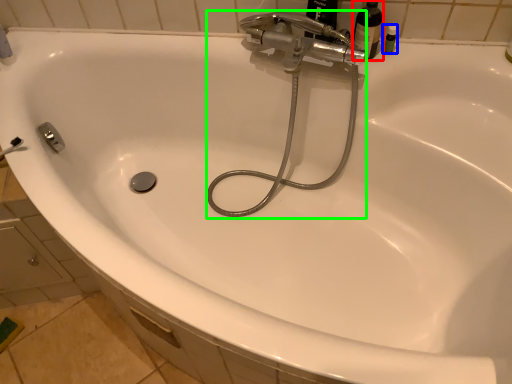
Question: Based on their relative distances, which object is farther from bottle (highlighted by a red box)? Choose from toiletry (highlighted by a blue box) and plumbing fixture (highlighted by a green box).

Choices:
 (A) toiletry
 (B) plumbing fixture

Answer: (B)